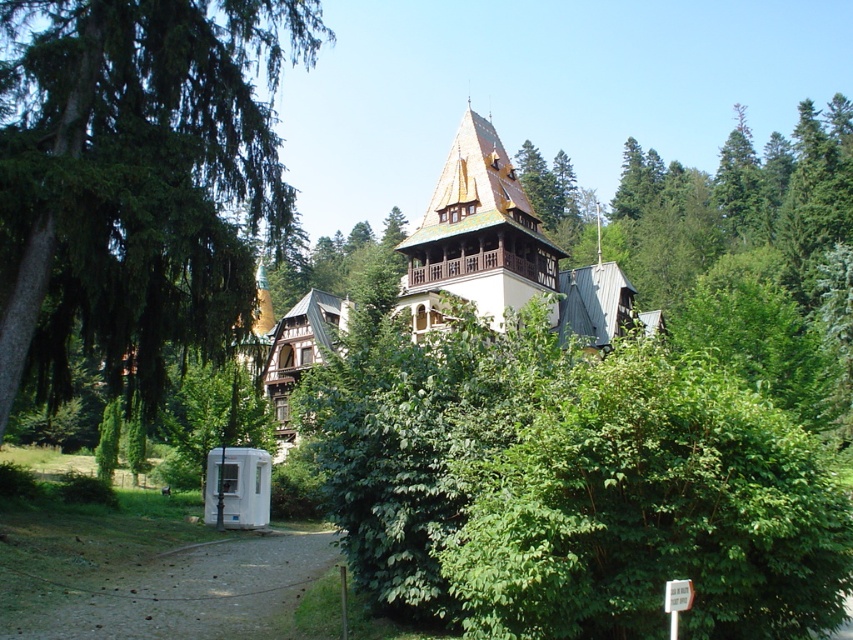
Question: Does green leafy tree at left have a smaller size compared to brown tiled roof at center?

Choices:
 (A) yes
 (B) no

Answer: (B)

Question: Which object is farther from the camera taking this photo?

Choices:
 (A) brown tiled roof at center
 (B) green leafy tree at left

Answer: (A)

Question: Does green leafy tree at left appear under brown tiled roof at center?

Choices:
 (A) no
 (B) yes

Answer: (B)

Question: Which object appears closest to the camera in this image?

Choices:
 (A) brown tiled roof at center
 (B) green leafy tree at left

Answer: (B)

Question: Does green leafy tree at left have a smaller size compared to brown tiled roof at center?

Choices:
 (A) no
 (B) yes

Answer: (A)